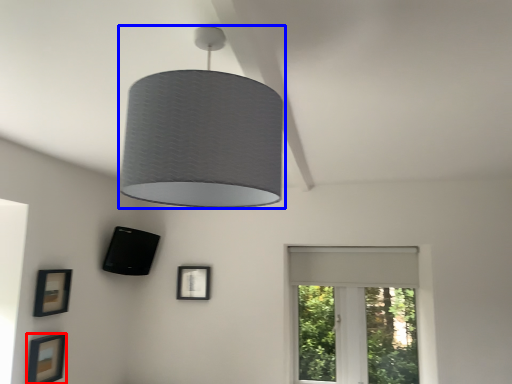
Question: Which object appears closest to the camera in this image, picture frame (highlighted by a red box) or lamp (highlighted by a blue box)?

Choices:
 (A) picture frame
 (B) lamp

Answer: (B)